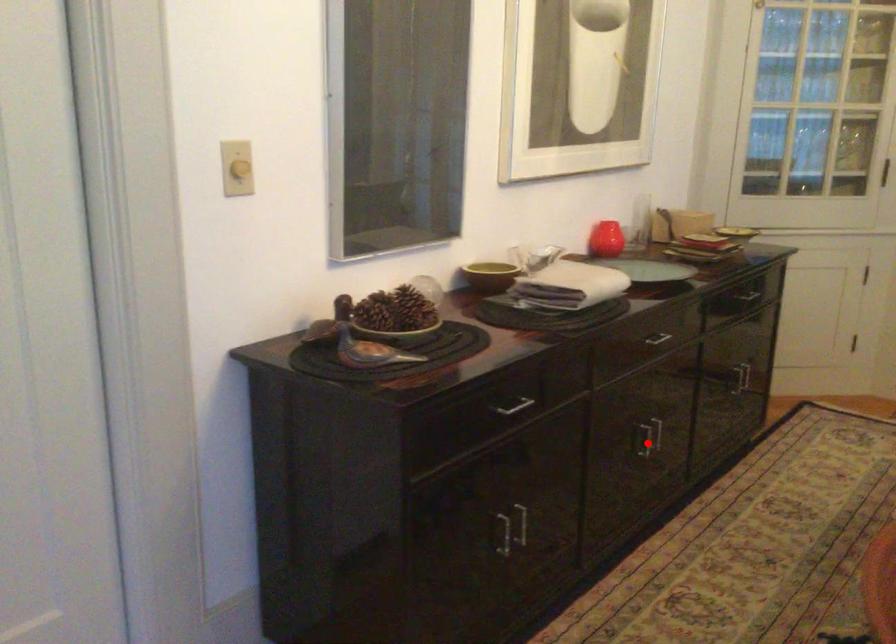
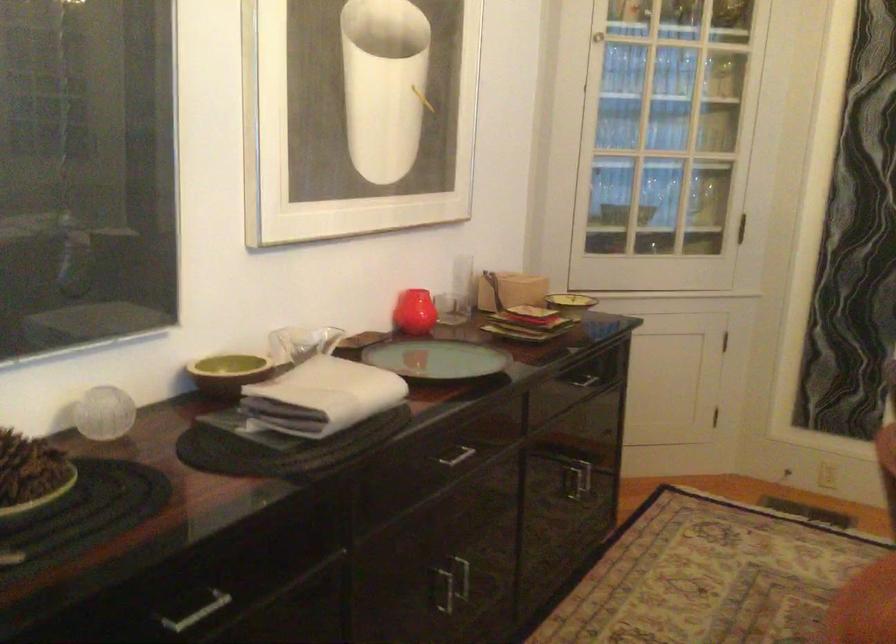
In the second image, find the point that corresponds to the highlighted location in the first image.

(443, 589)